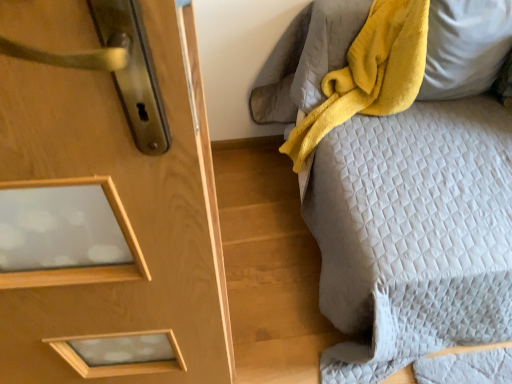
Question: Considering the positions of point (437, 51) and point (425, 132), is point (437, 51) closer or farther from the camera than point (425, 132)?

Choices:
 (A) farther
 (B) closer

Answer: (B)

Question: Is yellow soft pillow at upper right bigger or smaller than quilted gray bedspread at right?

Choices:
 (A) big
 (B) small

Answer: (B)

Question: Which of these objects is positioned farthest from the yellow plush blanket at upper right?

Choices:
 (A) quilted gray bedspread at right
 (B) yellow soft pillow at upper right

Answer: (A)

Question: Which is farther from the yellow soft pillow at upper right?

Choices:
 (A) quilted gray bedspread at right
 (B) yellow plush blanket at upper right

Answer: (A)